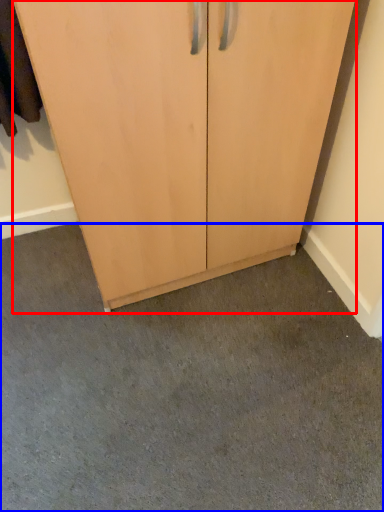
Question: Which object is further to the camera taking this photo, cupboard (highlighted by a red box) or concrete (highlighted by a blue box)?

Choices:
 (A) cupboard
 (B) concrete

Answer: (B)